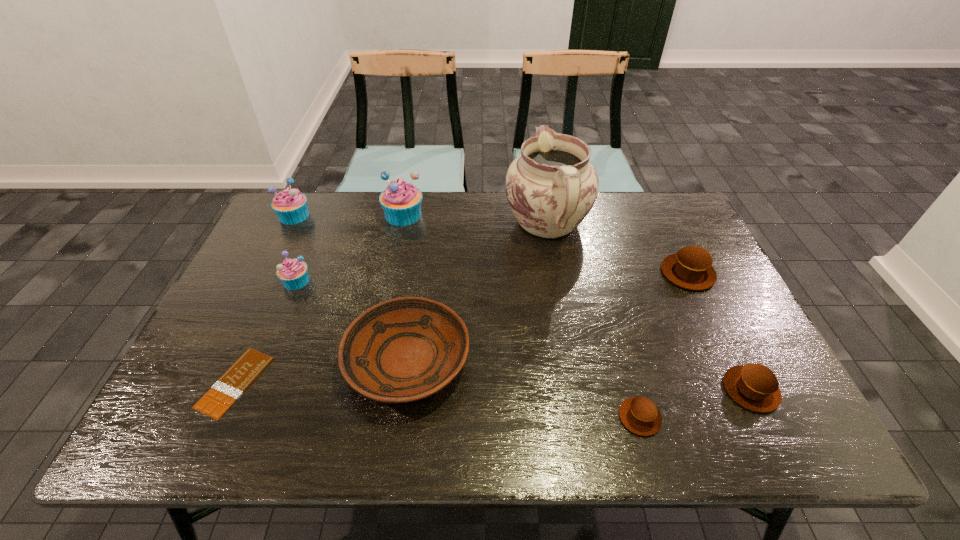
I want to click on the tallest object, so click(x=551, y=187).

At what (x,y) coordinates should I click in order to perform the action: click on purple pitcher. Please return your answer as a coordinate pair (x, y). Looking at the image, I should click on (551, 187).

Image resolution: width=960 pixels, height=540 pixels. I want to click on the eighth shortest object, so click(x=401, y=201).

At what (x,y) coordinates should I click in order to perform the action: click on the rightmost blue muffin. Please return your answer as a coordinate pair (x, y). Image resolution: width=960 pixels, height=540 pixels. Looking at the image, I should click on (401, 201).

Locate an element on the screen. the third tallest object is located at coordinates (290, 205).

The height and width of the screenshot is (540, 960). I want to click on the second tallest muffin, so click(290, 205).

You are a GUI agent. You are given a task and a screenshot of the screen. Output one action in this format:
    pyautogui.click(x=<x>, y=<y>)
    Task: Click on the nearest blue muffin
    
    Given the screenshot: What is the action you would take?
    pyautogui.click(x=293, y=273)

Where is `the biggest brown muffin`? This screenshot has width=960, height=540. the biggest brown muffin is located at coordinates (691, 268).

At what (x,y) coordinates should I click in order to perform the action: click on brown plate. Please return your answer as a coordinate pair (x, y). Looking at the image, I should click on (405, 349).

Locate an element on the screen. Image resolution: width=960 pixels, height=540 pixels. the second shortest muffin is located at coordinates (754, 386).